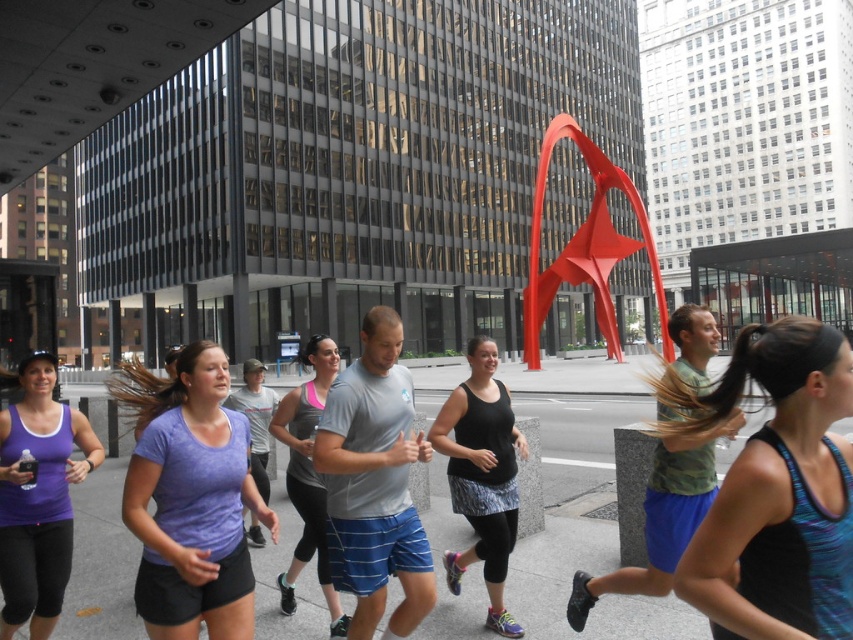
Question: Can you confirm if purple heather t-shirt at center is positioned to the left of purple matte tank top at lower left?

Choices:
 (A) yes
 (B) no

Answer: (B)

Question: Among these objects, which one is farthest from the camera?

Choices:
 (A) purple heather t-shirt at center
 (B) camouflage fabric shirt at center
 (C) purple matte tank top at lower left
 (D) black matte tank top at center

Answer: (D)

Question: Is camouflage fabric shirt at center closer to camera compared to matte gray tank top at center?

Choices:
 (A) yes
 (B) no

Answer: (A)

Question: Is matte black tank top at center bigger than camouflage fabric shirt at center?

Choices:
 (A) yes
 (B) no

Answer: (A)

Question: Which of these objects is positioned farthest from the matte black tank top at center?

Choices:
 (A) purple matte tank top at lower left
 (B) black matte tank top at center
 (C) camouflage fabric shirt at center
 (D) purple heather t-shirt at center

Answer: (A)

Question: Considering the real-world distances, which object is closest to the black matte tank top at center?

Choices:
 (A) camouflage fabric shirt at center
 (B) matte black tank top at center
 (C) purple heather t-shirt at center
 (D) matte gray tank top at center

Answer: (A)